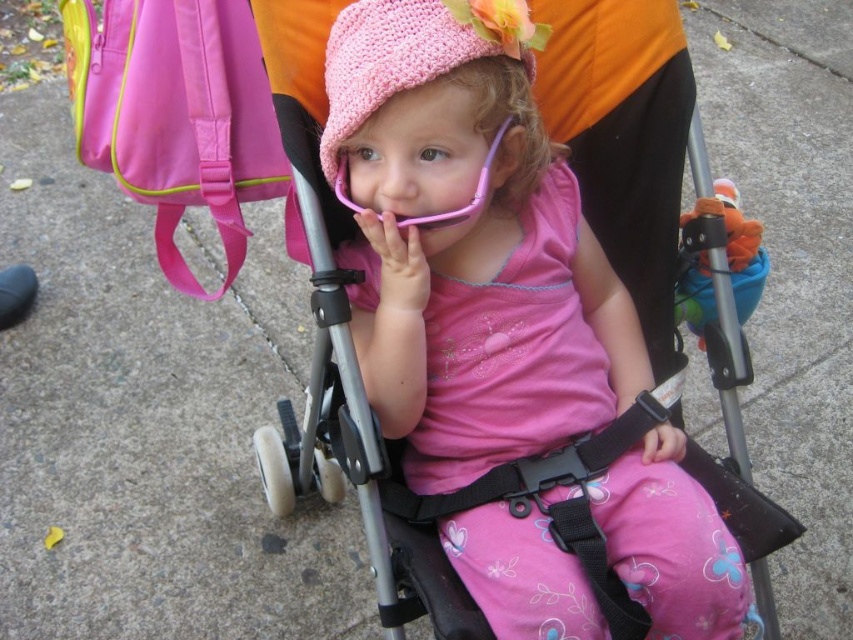
Question: Is pink knitted hat at center wider than crochet pink hat at center?

Choices:
 (A) yes
 (B) no

Answer: (A)

Question: Which point appears closest to the camera in this image?

Choices:
 (A) (460, 58)
 (B) (538, 195)

Answer: (A)

Question: Can you confirm if pink knitted hat at center is smaller than crochet pink hat at center?

Choices:
 (A) yes
 (B) no

Answer: (B)

Question: Which point is farther to the camera?

Choices:
 (A) (383, 124)
 (B) (339, 51)

Answer: (B)

Question: Is pink knitted hat at center to the left of crochet pink hat at center from the viewer's perspective?

Choices:
 (A) no
 (B) yes

Answer: (A)